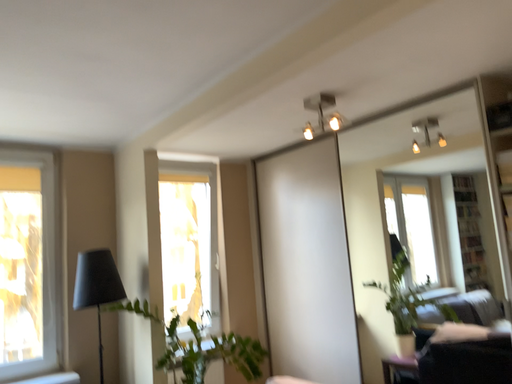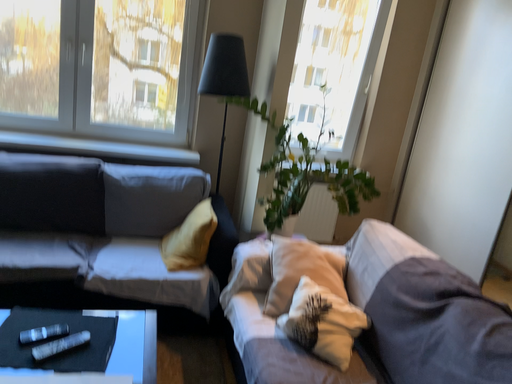
Question: How did the camera likely rotate when shooting the video?

Choices:
 (A) rotated upward
 (B) rotated downward

Answer: (B)